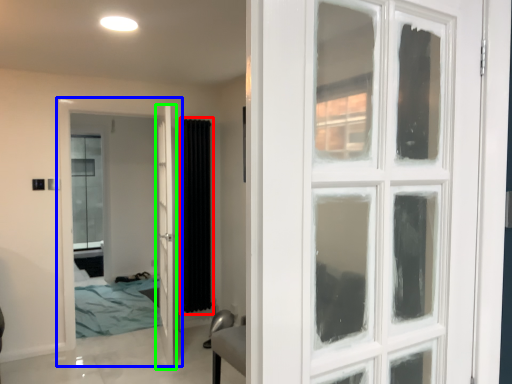
Question: Estimate the real-world distances between objects in this image. Which object is farther from curtain (highlighted by a red box), door (highlighted by a blue box) or door (highlighted by a green box)?

Choices:
 (A) door
 (B) door

Answer: (A)